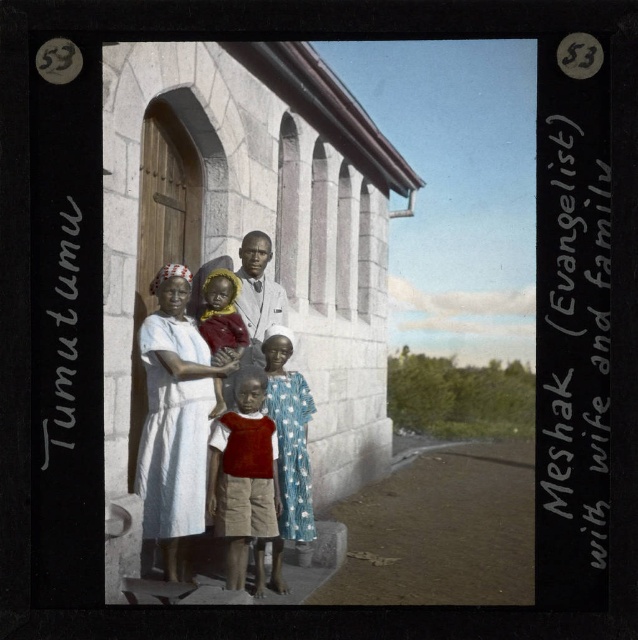
Which of these two, matte red shirt at center or light brown skin tone at center, stands shorter?

With less height is light brown skin tone at center.

Does matte red shirt at center have a larger size compared to light brown skin tone at center?

Yes, matte red shirt at center is bigger than light brown skin tone at center.

Describe the element at coordinates (242, 474) in the screenshot. I see `matte red shirt at center` at that location.

This screenshot has height=640, width=638. Identify the location of matte red shirt at center. (242, 474).

Can you confirm if white cotton dress at center is wider than light brown skin tone at center?

Yes.

Measure the distance from white cotton dress at center to light brown skin tone at center.

white cotton dress at center and light brown skin tone at center are 75.60 centimeters apart.

What do you see at coordinates (174, 422) in the screenshot? I see `white cotton dress at center` at bounding box center [174, 422].

Find the location of a particular element. white cotton dress at center is located at coordinates click(174, 422).

Is white cotton dress at center taller than matte red shirt at center?

Indeed, white cotton dress at center has a greater height compared to matte red shirt at center.

What do you see at coordinates (174, 422) in the screenshot? Image resolution: width=638 pixels, height=640 pixels. I see `white cotton dress at center` at bounding box center [174, 422].

Locate an element on the screen. white cotton dress at center is located at coordinates (174, 422).